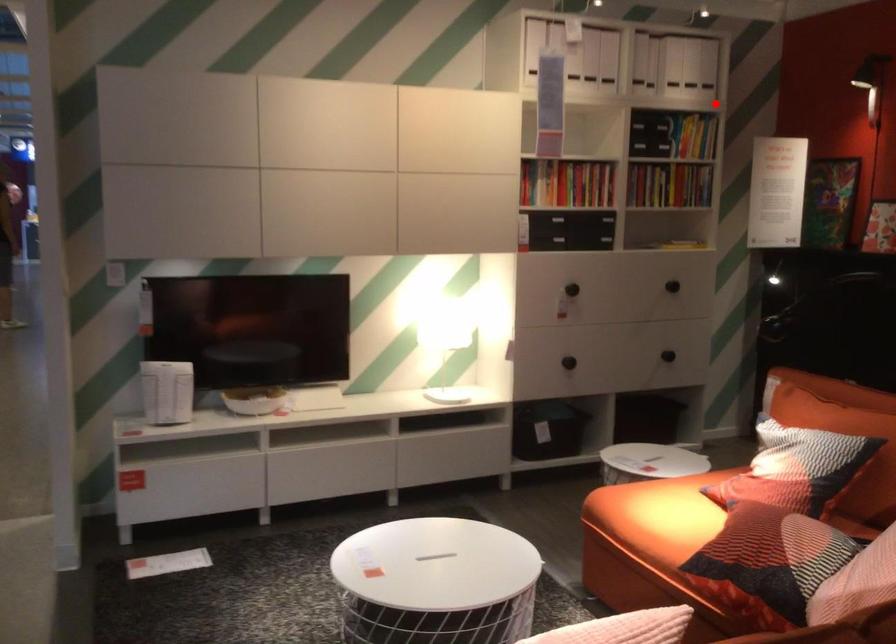
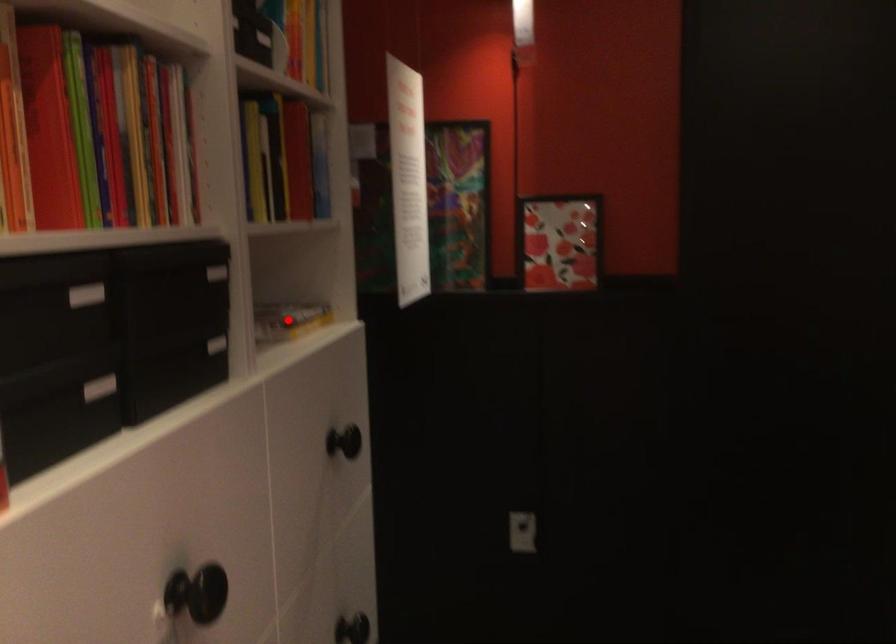
I am providing you with two images of the same scene from different viewpoints. A red point is marked on the first image and another point is marked on the second image. Is the marked point in image1 the same physical position as the marked point in image2?

No